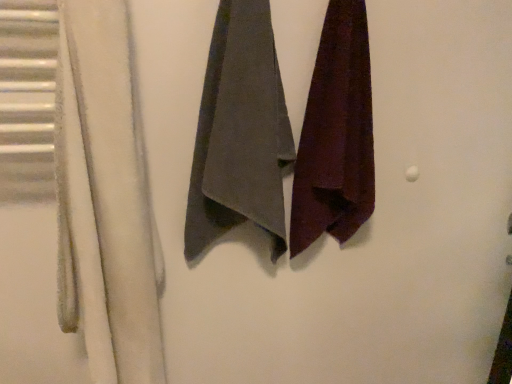
This screenshot has width=512, height=384. What do you see at coordinates (336, 134) in the screenshot? I see `velvet maroon towel at right, positioned as the first towel in right-to-left order` at bounding box center [336, 134].

How much space does velvet maroon towel at right, acting as the second towel starting from the left, occupy horizontally?

It is 5.23 inches.

What do you see at coordinates (239, 132) in the screenshot? This screenshot has height=384, width=512. I see `gray cotton towel at center, the first towel positioned from the left` at bounding box center [239, 132].

What are the coordinates of `white fuzzy towel at left` in the screenshot? It's located at (117, 184).

Is there a large distance between gray cotton towel at center, the first towel positioned from the left, and white fuzzy towel at left?

Actually, gray cotton towel at center, the first towel positioned from the left, and white fuzzy towel at left are a little close together.

The width and height of the screenshot is (512, 384). In order to click on towel that is the 1st object above the white fuzzy towel at left (from a real-world perspective) in this screenshot , I will do `click(239, 132)`.

From the image's perspective, would you say gray cotton towel at center, the 2th towel viewed from the right, is positioned over white fuzzy towel at left?

Correct, gray cotton towel at center, the 2th towel viewed from the right, appears higher than white fuzzy towel at left in the image.

From a real-world perspective, is gray cotton towel at center, the first towel positioned from the left, physically located above or below white fuzzy towel at left?

Clearly, from a real-world perspective, gray cotton towel at center, the first towel positioned from the left, is above white fuzzy towel at left.

Is white fuzzy towel at left oriented towards gray cotton towel at center, the 2th towel viewed from the right?

No, white fuzzy towel at left is not facing towards gray cotton towel at center, the 2th towel viewed from the right.

From a real-world perspective, is white fuzzy towel at left on gray cotton towel at center, the first towel positioned from the left?

Actually, white fuzzy towel at left is physically below gray cotton towel at center, the first towel positioned from the left, in the real world.

Which of these two, white fuzzy towel at left or gray cotton towel at center, the first towel positioned from the left, stands shorter?

With less height is gray cotton towel at center, the first towel positioned from the left.

What's the angular difference between white fuzzy towel at left and velvet maroon towel at right, acting as the second towel starting from the left,'s facing directions?

They differ by 0.000964 degrees in their facing directions.

Consider the image. Looking at the image, does white fuzzy towel at left seem bigger or smaller compared to velvet maroon towel at right, positioned as the first towel in right-to-left order?

Considering their sizes, white fuzzy towel at left takes up more space than velvet maroon towel at right, positioned as the first towel in right-to-left order.

Is white fuzzy towel at left in front of or behind velvet maroon towel at right, positioned as the first towel in right-to-left order, in the image?

white fuzzy towel at left is in front of velvet maroon towel at right, positioned as the first towel in right-to-left order.

Does velvet maroon towel at right, positioned as the first towel in right-to-left order, have a larger size compared to white fuzzy towel at left?

No.

Is velvet maroon towel at right, acting as the second towel starting from the left, surrounding white fuzzy towel at left?

No, velvet maroon towel at right, acting as the second towel starting from the left, does not contain white fuzzy towel at left.

Which is behind, velvet maroon towel at right, positioned as the first towel in right-to-left order, or white fuzzy towel at left?

Positioned behind is velvet maroon towel at right, positioned as the first towel in right-to-left order.

Is white fuzzy towel at left at the back of velvet maroon towel at right, acting as the second towel starting from the left?

That's not correct — velvet maroon towel at right, acting as the second towel starting from the left, is not looking away from white fuzzy towel at left.

From the image's perspective, which is below, velvet maroon towel at right, acting as the second towel starting from the left, or gray cotton towel at center, the 2th towel viewed from the right?

gray cotton towel at center, the 2th towel viewed from the right, from the image's perspective.

From a real-world perspective, which object stands above the other?

From a 3D spatial view, velvet maroon towel at right, acting as the second towel starting from the left, is above.

Is velvet maroon towel at right, positioned as the first towel in right-to-left order, to the left or to the right of gray cotton towel at center, the 2th towel viewed from the right, in the image?

In the image, velvet maroon towel at right, positioned as the first towel in right-to-left order, appears on the right side of gray cotton towel at center, the 2th towel viewed from the right.

Does gray cotton towel at center, the first towel positioned from the left, have a greater width compared to velvet maroon towel at right, positioned as the first towel in right-to-left order?

In fact, gray cotton towel at center, the first towel positioned from the left, might be narrower than velvet maroon towel at right, positioned as the first towel in right-to-left order.

From a real-world perspective, is gray cotton towel at center, the first towel positioned from the left, on top of velvet maroon towel at right, positioned as the first towel in right-to-left order?

No.

Image resolution: width=512 pixels, height=384 pixels. Identify the location of towel on the right of gray cotton towel at center, the 2th towel viewed from the right. tap(336, 134).

From the image's perspective, is gray cotton towel at center, the 2th towel viewed from the right, under velvet maroon towel at right, acting as the second towel starting from the left?

Indeed, from the image's perspective, gray cotton towel at center, the 2th towel viewed from the right, is shown beneath velvet maroon towel at right, acting as the second towel starting from the left.

Locate an element on the screen. Image resolution: width=512 pixels, height=384 pixels. curtain on the left side of gray cotton towel at center, the first towel positioned from the left is located at coordinates (117, 184).

Identify the location of curtain located below the gray cotton towel at center, the 2th towel viewed from the right (from the image's perspective). (117, 184).

Looking at the image, which one is located closer to white fuzzy towel at left, velvet maroon towel at right, acting as the second towel starting from the left, or gray cotton towel at center, the first towel positioned from the left?

gray cotton towel at center, the first towel positioned from the left.

Estimate the real-world distances between objects in this image. Which object is closer to gray cotton towel at center, the 2th towel viewed from the right, white fuzzy towel at left or velvet maroon towel at right, positioned as the first towel in right-to-left order?

Among the two, velvet maroon towel at right, positioned as the first towel in right-to-left order, is located nearer to gray cotton towel at center, the 2th towel viewed from the right.

Looking at the image, which one is located closer to velvet maroon towel at right, acting as the second towel starting from the left, white fuzzy towel at left or gray cotton towel at center, the first towel positioned from the left?

gray cotton towel at center, the first towel positioned from the left, lies closer to velvet maroon towel at right, acting as the second towel starting from the left, than the other object.

Based on the photo, estimate the real-world distances between objects in this image. Which object is closer to white fuzzy towel at left, gray cotton towel at center, the 2th towel viewed from the right, or velvet maroon towel at right, acting as the second towel starting from the left?

Based on the image, gray cotton towel at center, the 2th towel viewed from the right, appears to be nearer to white fuzzy towel at left.

In the scene shown: Looking at the image, which one is located further to gray cotton towel at center, the first towel positioned from the left, velvet maroon towel at right, positioned as the first towel in right-to-left order, or white fuzzy towel at left?

white fuzzy towel at left lies further to gray cotton towel at center, the first towel positioned from the left, than the other object.

Considering their positions, is gray cotton towel at center, the 2th towel viewed from the right, positioned further to velvet maroon towel at right, positioned as the first towel in right-to-left order, than white fuzzy towel at left?

white fuzzy towel at left is positioned further to the anchor velvet maroon towel at right, positioned as the first towel in right-to-left order.

In order to click on towel between white fuzzy towel at left and velvet maroon towel at right, acting as the second towel starting from the left in this screenshot , I will do `click(239, 132)`.